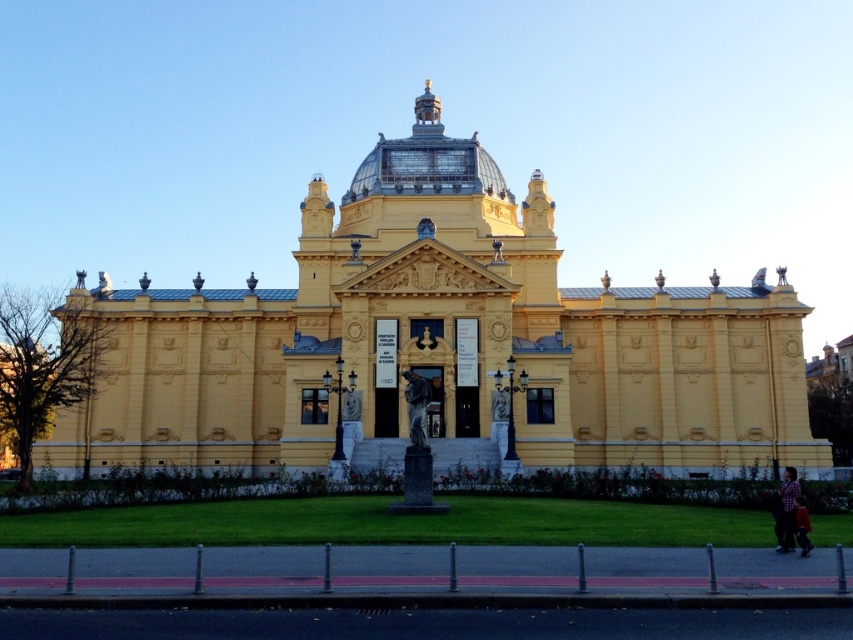
Question: Is yellow stone church at center to the left of bronze statue at center from the viewer's perspective?

Choices:
 (A) no
 (B) yes

Answer: (B)

Question: Which object is closer to the camera taking this photo?

Choices:
 (A) dark brown leather jacket at lower right
 (B) yellow stone church at center
 (C) bronze statue at center

Answer: (A)

Question: Does bronze statue at center appear on the left side of plaid shirt at lower right?

Choices:
 (A) no
 (B) yes

Answer: (B)

Question: Estimate the real-world distances between objects in this image. Which object is farther from the dark brown leather jacket at lower right?

Choices:
 (A) plaid shirt at lower right
 (B) bronze statue at center

Answer: (B)

Question: Observing the image, what is the correct spatial positioning of yellow stone church at center in reference to bronze statue at center?

Choices:
 (A) right
 (B) left

Answer: (B)

Question: Which is farther from the yellow stone church at center?

Choices:
 (A) bronze statue at center
 (B) plaid shirt at lower right
 (C) dark brown leather jacket at lower right

Answer: (C)